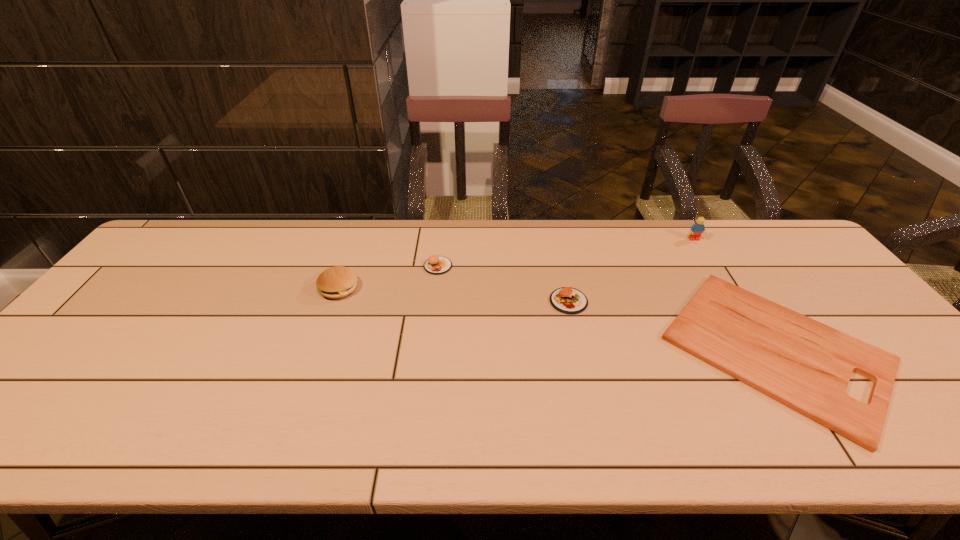
Find the location of `Lego`. Lego is located at coordinates (697, 229).

Identify the location of the tallest object. Image resolution: width=960 pixels, height=540 pixels. (697, 229).

You are a GUI agent. You are given a task and a screenshot of the screen. Output one action in this format:
    pyautogui.click(x=<x>, y=<y>)
    Task: Click on the leftmost patty (food)
    This screenshot has height=540, width=960.
    Given the screenshot: What is the action you would take?
    pyautogui.click(x=337, y=282)

Find the location of a particular element. Image resolution: width=960 pixels, height=540 pixels. the tallest patty (food) is located at coordinates (337, 282).

At what (x,y) coordinates should I click in order to perform the action: click on the farthest patty (food). Please return your answer as a coordinate pair (x, y). Looking at the image, I should click on (436, 265).

Where is `the second shortest patty (food)`? The width and height of the screenshot is (960, 540). the second shortest patty (food) is located at coordinates (436, 265).

The image size is (960, 540). In order to click on the shortest patty (food) in this screenshot , I will do `click(568, 300)`.

This screenshot has height=540, width=960. Find the location of `the third object from left to right`. the third object from left to right is located at coordinates (568, 300).

Identify the location of free spot located on the face of the tallest object. (735, 307).

Locate an element on the screen. The height and width of the screenshot is (540, 960). vacant space located on the right of the tallest patty (food) is located at coordinates (424, 288).